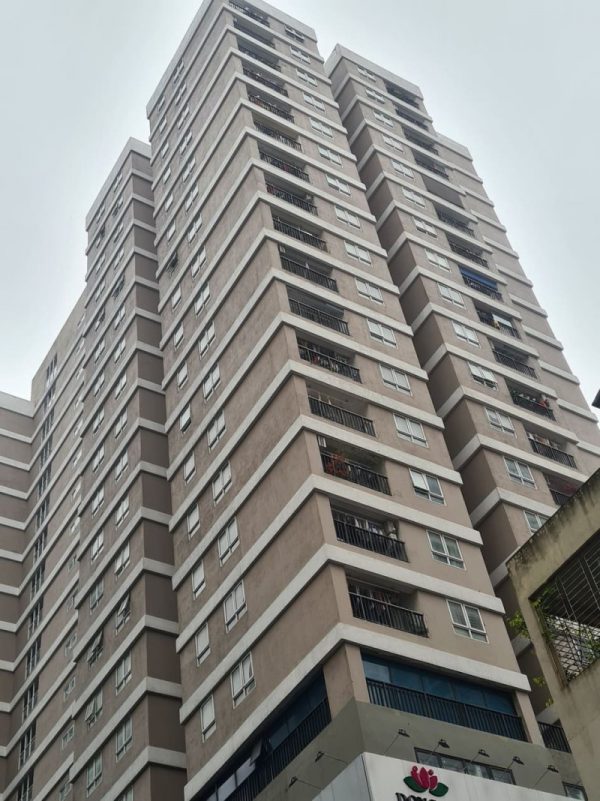
I want to click on lights, so click(x=290, y=783), click(x=318, y=753), click(x=398, y=734), click(x=440, y=741), click(x=481, y=751), click(x=512, y=759), click(x=552, y=767).